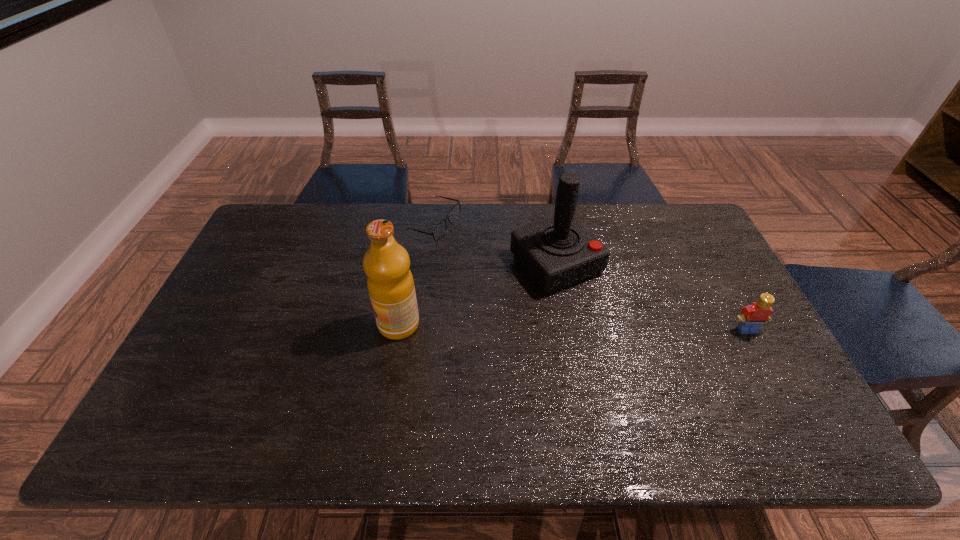
Locate an element on the screen. The image size is (960, 540). fruit juice is located at coordinates (390, 283).

Where is `the rightmost object`? the rightmost object is located at coordinates (752, 316).

Locate an element on the screen. the third tallest object is located at coordinates (752, 316).

This screenshot has width=960, height=540. Find the location of `spectacles`. spectacles is located at coordinates (440, 229).

At what (x,y) coordinates should I click in order to perform the action: click on the second object from right to left. Please return your answer as a coordinate pair (x, y). Looking at the image, I should click on (557, 252).

Locate an element on the screen. The height and width of the screenshot is (540, 960). vacant area situated 0.290m on the front label of the fruit juice is located at coordinates (274, 325).

Identify the location of free space located on the front label of the fruit juice. This screenshot has height=540, width=960. (352, 325).

The width and height of the screenshot is (960, 540). Find the location of `vacant area located on the front label of the fruit juice`. vacant area located on the front label of the fruit juice is located at coordinates (331, 325).

This screenshot has height=540, width=960. In order to click on vacant region located on the front-facing side of the rightmost object in this screenshot , I will do 772,376.

Image resolution: width=960 pixels, height=540 pixels. I want to click on vacant position located 0.200m with the lenses facing outward on the spectacles, so click(480, 275).